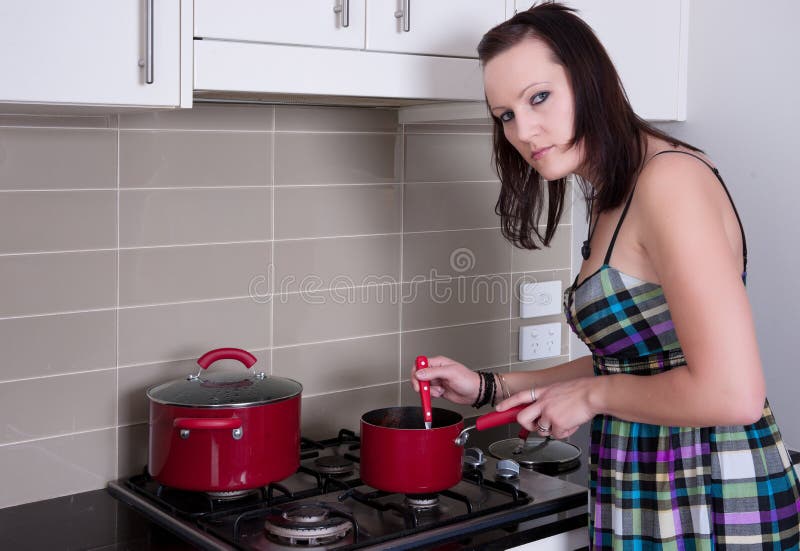
The image size is (800, 551). I want to click on cabinets, so click(94, 41), click(302, 10), click(453, 30).